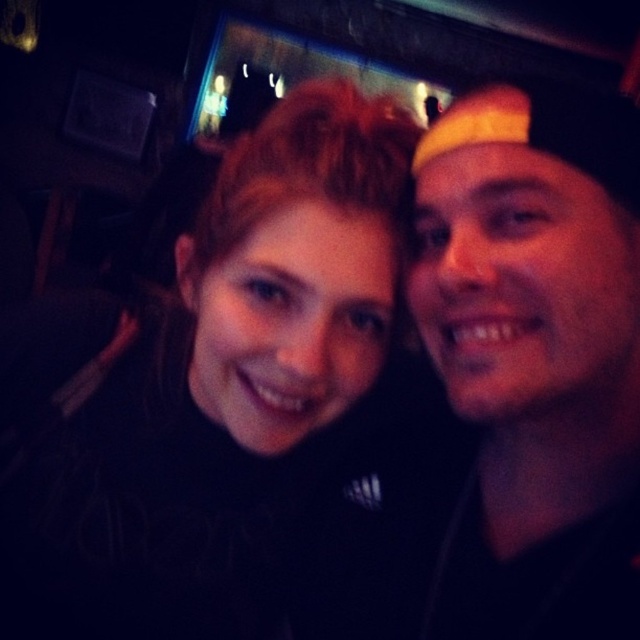
You are standing in the room where the two people are taking a selfie. There is a point at coordinates point (42, 444) that is 28.44 inches away from you. If you want to touch this point without moving your feet, can you reach it?

The point (42, 444) is 28.44 inches away from the viewer. Since the average person can reach about 24 to 30 inches in front of themselves without moving their feet, you might be able to reach it depending on your arm length. However, this is close to the maximum typical reach, so it could be challenging.

You are standing in front of the two people taking a selfie. You want to place a small sticker on the point that is closer to you. Which point should you choose between point (308, 148) and point (572, 396)?

Point (572, 396) is closer to you than point (308, 148), so you should choose point (572, 396) to place the sticker.

You are a photographer trying to adjust the lighting for a portrait. You notice the black matte hair at center and the yellow fabric cap at right in the frame. Which object should you focus on to ensure proper exposure, considering their sizes?

The black matte hair at center has a larger size compared to the yellow fabric cap at right, so you should focus on the black matte hair at center to ensure proper exposure since it occupies more of the frame.